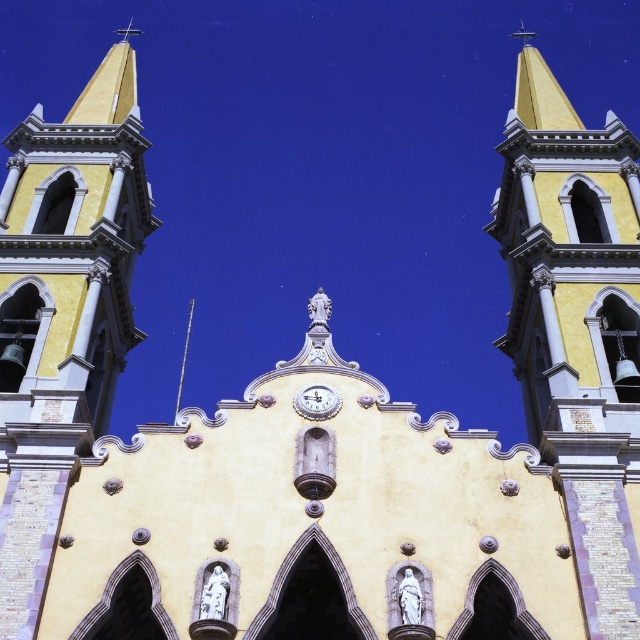
From the picture: You are standing in front of the church and want to know which object is taller between the smooth yellow steeple at upper center and the white glossy clock at center. Can you determine this based on their positions?

The smooth yellow steeple at upper center is taller than the white glossy clock at center according to their positions in the scene.

From the picture: You are standing in front of the church and want to take a photo that includes both the yellow stucco bell tower at left and the white glossy clock at center. Which object should you focus on first if you want to ensure both are fully visible in the frame?

You should focus on the yellow stucco bell tower at left first because it is much taller than the white glossy clock at center, so adjusting the frame to accommodate its height will naturally include the smaller clock in the composition.

You are a drone operator who needs to fly a drone from the shiny silver spire at center to the smooth yellow steeple at upper center. What is the approximate distance you need to cover?

The smooth yellow steeple at upper center is 365.79 feet from the shiny silver spire at center, so the drone needs to cover approximately 365.79 feet to fly from the shiny silver spire at center to the smooth yellow steeple at upper center.